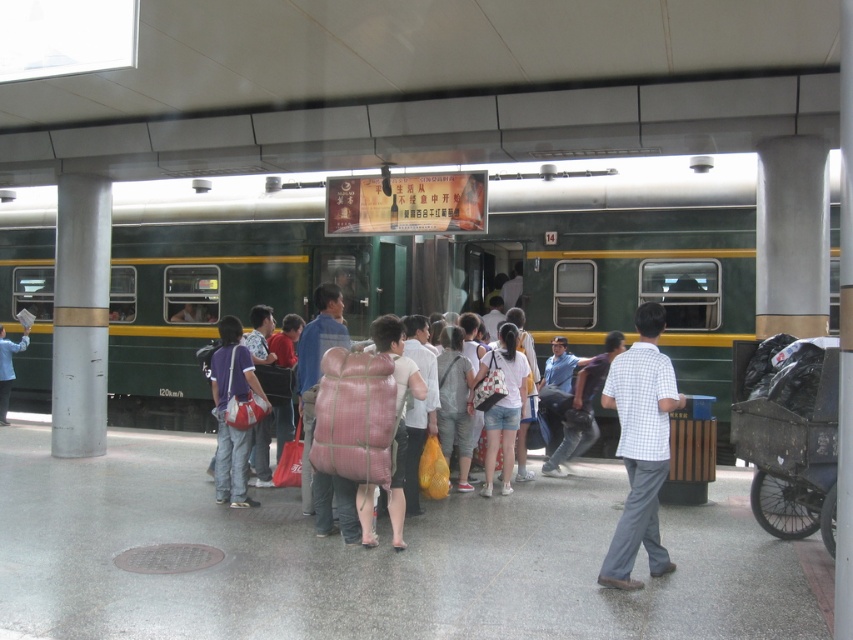
You are a passenger waiting to board the green matte train at center. There is a person wearing a matte black shirt at center blocking your path. Can you walk around them to reach the train?

The green matte train at center is in front of the matte black shirt at center, meaning the person is between you and the train. You would need to walk around them to reach the train.

You are a passenger waiting at the train station. You see the green matte train at center and the matte black shirt at center. Which object is closer to you?

The matte black shirt at center is closer to you because the green matte train at center is positioned over it, indicating it is farther away.

You are standing on the train station platform and want to move from point A to point B. Point A is at coordinate point (x=115, y=300) and point B is at coordinate point (x=0, y=401). Which point is closer to you when you start at point A?

Point A at coordinate point (x=115, y=300) is closer to you because it is your starting position.